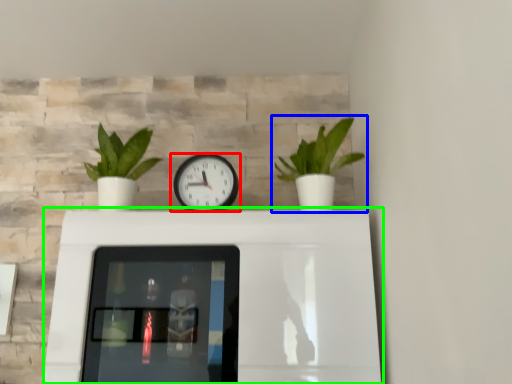
Question: Which object is the closest to the wall clock (highlighted by a red box)? Choose among these: houseplant (highlighted by a blue box) or table (highlighted by a green box).

Choices:
 (A) houseplant
 (B) table

Answer: (A)